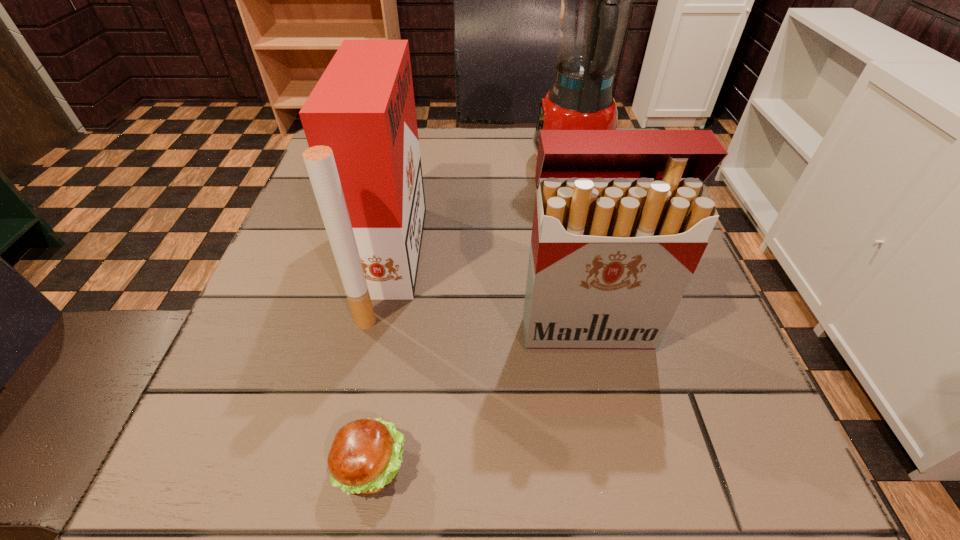
The width and height of the screenshot is (960, 540). In the image, there is a desktop. In order to click on vacant area at the right edge in this screenshot , I will do `click(677, 386)`.

Locate an element on the screen. Image resolution: width=960 pixels, height=540 pixels. vacant position at the near left corner of the desktop is located at coordinates (183, 511).

You are a GUI agent. You are given a task and a screenshot of the screen. Output one action in this format:
    pyautogui.click(x=<x>, y=<y>)
    Task: Click on the empty location between the right cigarette case and the left cigarette case
    
    Given the screenshot: What is the action you would take?
    pyautogui.click(x=489, y=295)

This screenshot has height=540, width=960. In order to click on empty space that is in between the left cigarette case and the tallest object in this screenshot , I will do `click(481, 215)`.

This screenshot has height=540, width=960. Identify the location of empty space that is in between the left cigarette case and the tallest object. pyautogui.click(x=481, y=215).

Identify the location of free space between the nearest object and the left cigarette case. (382, 364).

This screenshot has width=960, height=540. What are the coordinates of `vacant area that lies between the hamburger and the left cigarette case` in the screenshot? It's located at pos(382,364).

In order to click on free point between the left cigarette case and the right cigarette case in this screenshot , I will do `click(489, 295)`.

The height and width of the screenshot is (540, 960). Identify the location of object that is the second closest to the left cigarette case. (622, 218).

Locate an element on the screen. object identified as the second closest to the left cigarette case is located at coordinates (622, 218).